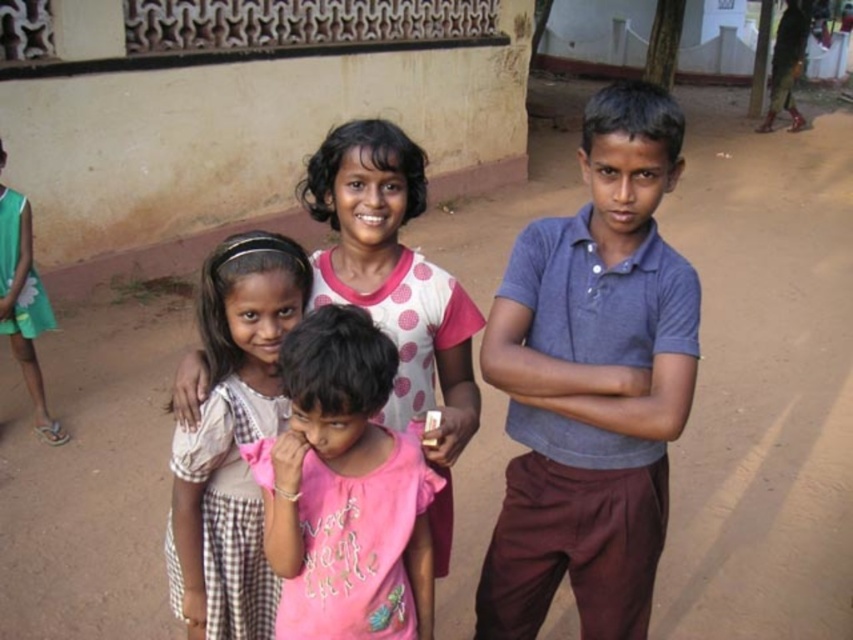
Between point (607, 332) and point (277, 234), which one is positioned in front?

Point (607, 332) is more forward.

Is gray cotton shirt at center to the left of pink fabric at center from the viewer's perspective?

Incorrect, gray cotton shirt at center is not on the left side of pink fabric at center.

This screenshot has height=640, width=853. What do you see at coordinates (592, 381) in the screenshot?
I see `gray cotton shirt at center` at bounding box center [592, 381].

Locate an element on the screen. Image resolution: width=853 pixels, height=640 pixels. gray cotton shirt at center is located at coordinates (592, 381).

Does gray cotton shirt at center appear on the left side of pink cotton shirt at center?

No, gray cotton shirt at center is not to the left of pink cotton shirt at center.

Does gray cotton shirt at center lie behind pink cotton shirt at center?

Yes, it is behind pink cotton shirt at center.

Measure the distance between gray cotton shirt at center and camera.

The distance of gray cotton shirt at center from camera is 1.69 meters.

Identify the location of gray cotton shirt at center. (592, 381).

Can you confirm if pink cotton shirt at center is positioned to the left of pink fabric at center?

In fact, pink cotton shirt at center is to the right of pink fabric at center.

Is pink cotton shirt at center bigger than pink fabric at center?

Actually, pink cotton shirt at center might be smaller than pink fabric at center.

Is point (291, 497) less distant than point (244, 250)?

Yes, it is.

Locate an element on the screen. The height and width of the screenshot is (640, 853). pink cotton shirt at center is located at coordinates (344, 490).